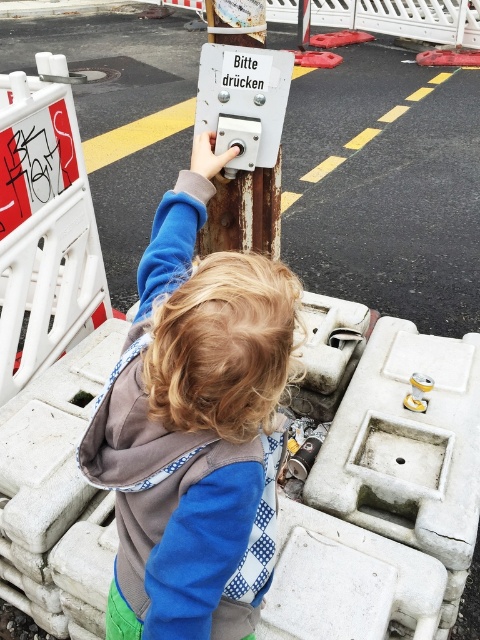
Is point (206, 177) positioned before point (237, 189)?

That is True.

Can you confirm if blue fleece jacket at center is wider than rusty metal button at center?

Yes.

What are the coordinates of `blue fleece jacket at center` in the screenshot? It's located at (193, 420).

This screenshot has width=480, height=640. I want to click on blue fleece jacket at center, so click(x=193, y=420).